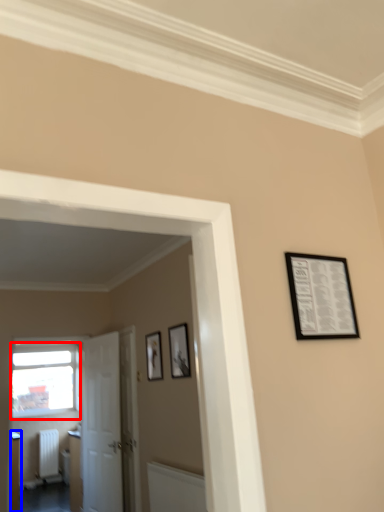
Question: Among these objects, which one is farthest to the camera, window (highlighted by a red box) or furniture (highlighted by a blue box)?

Choices:
 (A) window
 (B) furniture

Answer: (A)